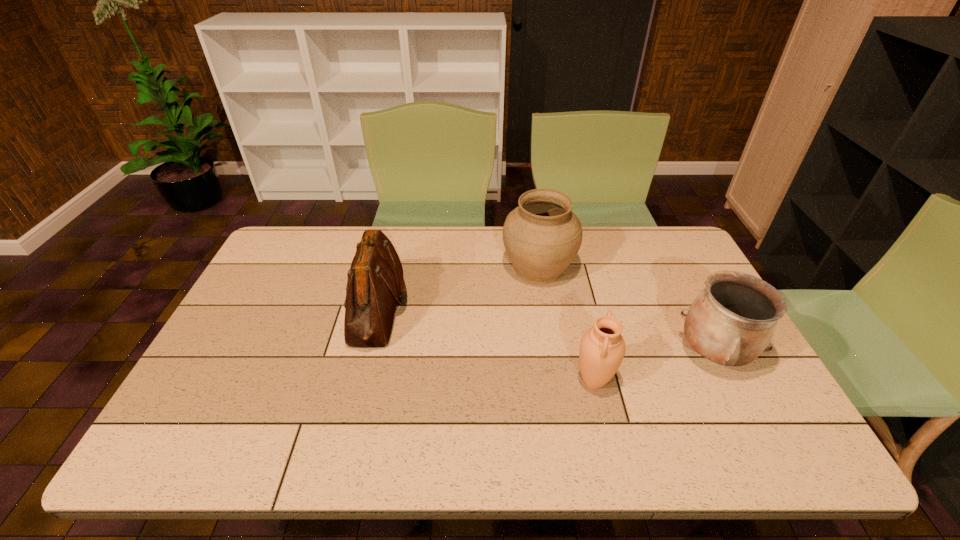
Identify the location of vacant space that is in between the rightmost urn and the leftmost object. This screenshot has height=540, width=960. (545, 330).

At what (x,y) coordinates should I click in order to perform the action: click on the third closest object to the farthest urn. Please return your answer as a coordinate pair (x, y). Image resolution: width=960 pixels, height=540 pixels. Looking at the image, I should click on (375, 282).

Locate which object is the third closest to the rightmost urn. Please provide its 2D coordinates. Your answer should be formatted as a tuple, i.e. [(x, y)], where the tuple contains the x and y coordinates of a point satisfying the conditions above.

[(375, 282)]

Where is `urn identified as the closest to the farthest urn`? Image resolution: width=960 pixels, height=540 pixels. urn identified as the closest to the farthest urn is located at coordinates pyautogui.click(x=731, y=322).

At what (x,y) coordinates should I click in order to perform the action: click on urn that is the second closest one to the rightmost object. Please return your answer as a coordinate pair (x, y). This screenshot has width=960, height=540. Looking at the image, I should click on tap(542, 236).

Where is `free region that satisfies the following two spatial constraints: 1. on the front side of the farthest urn; 2. on the left side of the rightmost object`? The height and width of the screenshot is (540, 960). free region that satisfies the following two spatial constraints: 1. on the front side of the farthest urn; 2. on the left side of the rightmost object is located at coordinates (551, 353).

Where is `free space that satisfies the following two spatial constraints: 1. on the front side of the rightmost urn; 2. on the right side of the farthest urn`? Image resolution: width=960 pixels, height=540 pixels. free space that satisfies the following two spatial constraints: 1. on the front side of the rightmost urn; 2. on the right side of the farthest urn is located at coordinates (551, 353).